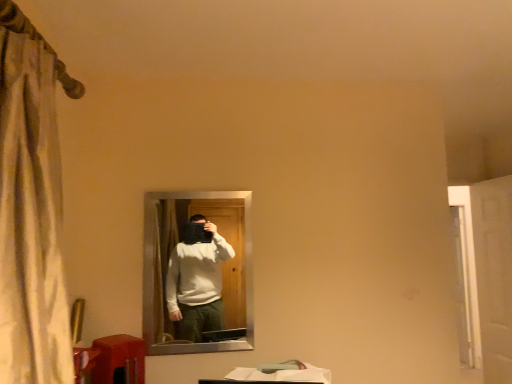
Find the location of `matte black mirror at center`. matte black mirror at center is located at coordinates (159, 264).

Where is `white glossy door at right`? white glossy door at right is located at coordinates (494, 274).

This screenshot has height=384, width=512. What are the coordinates of `matte orange table at lower left` in the screenshot? It's located at (119, 360).

Which is closer, (134, 380) or (247, 349)?

The point (134, 380) is more forward.

What's the angular difference between matte orange table at lower left and matte black mirror at center's facing directions?

The angular difference between matte orange table at lower left and matte black mirror at center is 87.4 degrees.

Who is smaller, matte orange table at lower left or matte black mirror at center?

matte orange table at lower left.

Which object is wider, matte orange table at lower left or matte black mirror at center?

Wider between the two is matte orange table at lower left.

How many degrees apart are the facing directions of matte black mirror at center and matte orange table at lower left?

87.4 degrees separate the facing orientations of matte black mirror at center and matte orange table at lower left.

Is matte black mirror at center not inside matte orange table at lower left?

→ That's correct, matte black mirror at center is outside of matte orange table at lower left.

Which of these two, matte black mirror at center or matte orange table at lower left, is bigger?

matte black mirror at center is bigger.

Measure the distance from matte black mirror at center to matte orange table at lower left.

matte black mirror at center and matte orange table at lower left are 10.15 inches apart.

Does white glossy door at right turn towards matte black mirror at center?

No, white glossy door at right does not turn towards matte black mirror at center.

Would you consider white glossy door at right to be distant from matte black mirror at center?

Yes, white glossy door at right is far from matte black mirror at center.

In terms of size, does white glossy door at right appear bigger or smaller than matte black mirror at center?

white glossy door at right is bigger than matte black mirror at center.

Is white glossy door at right behind matte black mirror at center?

Yes, the depth of white glossy door at right is greater than that of matte black mirror at center.

This screenshot has height=384, width=512. What are the coordinates of `screen door behind the matte black mirror at center` in the screenshot? It's located at tap(494, 274).

Is matte black mirror at center positioned with its back to white glossy door at right?

matte black mirror at center is not turned away from white glossy door at right.

Does matte black mirror at center have a smaller size compared to white glossy door at right?

Correct, matte black mirror at center occupies less space than white glossy door at right.

Considering the relative sizes of matte black mirror at center and white glossy door at right in the image provided, is matte black mirror at center wider than white glossy door at right?

No.

Is white glossy door at right not within matte orange table at lower left?

Indeed, white glossy door at right is completely outside matte orange table at lower left.

Identify the location of table in front of the white glossy door at right. Image resolution: width=512 pixels, height=384 pixels. (119, 360).

Could you tell me if white glossy door at right is turned towards matte orange table at lower left?

No, white glossy door at right does not turn towards matte orange table at lower left.

Can you confirm if white glossy door at right is smaller than matte orange table at lower left?

No.

Is matte orange table at lower left far from white glossy door at right?

Yes.

From a real-world perspective, between matte orange table at lower left and white glossy door at right, who is vertically lower?

matte orange table at lower left, from a real-world perspective.

How many degrees apart are the facing directions of matte orange table at lower left and white glossy door at right?

The angle between the facing direction of matte orange table at lower left and the facing direction of white glossy door at right is 180 degrees.

Find the location of a particular element. Image resolution: width=512 pixels, height=384 pixels. screen door lying above the matte orange table at lower left (from the image's perspective) is located at coordinates (494, 274).

This screenshot has height=384, width=512. What are the coordinates of `mirror behind the matte orange table at lower left` in the screenshot? It's located at (159, 264).

Locate an element on the screen. mirror that appears above the matte orange table at lower left (from the image's perspective) is located at coordinates (159, 264).

From the image, which object appears to be farther from white glossy door at right, matte orange table at lower left or matte black mirror at center?

Based on the image, matte orange table at lower left appears to be further to white glossy door at right.

Based on their spatial positions, is matte black mirror at center or white glossy door at right further from matte orange table at lower left?

white glossy door at right lies further to matte orange table at lower left than the other object.

From the image, which object appears to be farther from white glossy door at right, matte black mirror at center or matte orange table at lower left?

matte orange table at lower left is further to white glossy door at right.

Which object lies further to the anchor point matte black mirror at center, matte orange table at lower left or white glossy door at right?

white glossy door at right lies further to matte black mirror at center than the other object.

Looking at the image, which one is located closer to matte orange table at lower left, white glossy door at right or matte black mirror at center?

matte black mirror at center lies closer to matte orange table at lower left than the other object.

Based on their spatial positions, is white glossy door at right or matte orange table at lower left closer to matte black mirror at center?

matte orange table at lower left.

You are a GUI agent. You are given a task and a screenshot of the screen. Output one action in this format:
    pyautogui.click(x=<x>, y=<y>)
    Task: Click on the mirror located between matte orange table at lower left and white glossy door at right in the left-right direction
    The height and width of the screenshot is (384, 512).
    Given the screenshot: What is the action you would take?
    pyautogui.click(x=159, y=264)